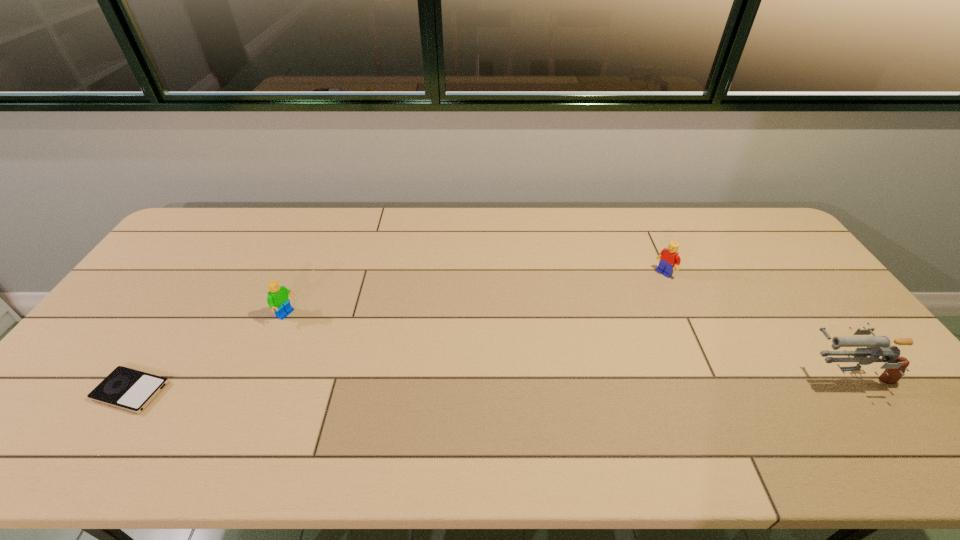
You are a GUI agent. You are given a task and a screenshot of the screen. Output one action in this format:
    pyautogui.click(x=<x>, y=<y>)
    Task: Click on the vacant position located 0.050m at the barrel end of the gun
    
    Given the screenshot: What is the action you would take?
    pyautogui.click(x=780, y=374)

I want to click on vacant area located 0.290m at the barrel end of the gun, so click(x=686, y=374).

Locate an element on the screen. This screenshot has width=960, height=540. vacant position located on the face of the left Lego is located at coordinates (342, 345).

This screenshot has height=540, width=960. What are the coordinates of `free region located on the face of the left Lego` in the screenshot? It's located at (398, 374).

Find the location of a particular element. Image resolution: width=960 pixels, height=540 pixels. vacant space located 0.170m on the face of the left Lego is located at coordinates coord(339,343).

Identify the location of vacant space located on the face of the right Lego. The height and width of the screenshot is (540, 960). [620, 305].

At what (x,y) coordinates should I click in order to perform the action: click on free space located on the face of the right Lego. Please return your answer as a coordinate pair (x, y). This screenshot has width=960, height=540. Looking at the image, I should click on (613, 309).

Image resolution: width=960 pixels, height=540 pixels. I want to click on vacant space located 0.340m on the face of the right Lego, so click(x=586, y=328).

Where is `iPod located in the near edge section of the desktop`? iPod located in the near edge section of the desktop is located at coordinates (125, 388).

You are a GUI agent. You are given a task and a screenshot of the screen. Output one action in this format:
    pyautogui.click(x=<x>, y=<y>)
    Task: Click on the gun positioned at the near edge
    This screenshot has height=540, width=960.
    Given the screenshot: What is the action you would take?
    pyautogui.click(x=876, y=346)